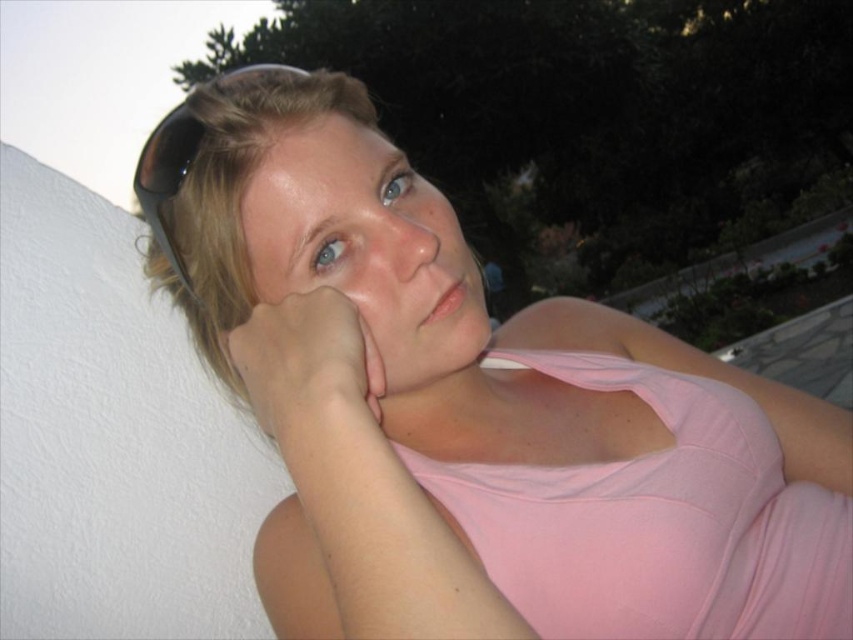
Question: Which of the following is the closest to the observer?

Choices:
 (A) (315, 408)
 (B) (177, 145)

Answer: (A)

Question: Which object appears farthest from the camera in this image?

Choices:
 (A) black rubber goggles at upper left
 (B) pink matte hand at center

Answer: (A)

Question: Is pink matte hand at center smaller than black rubber goggles at upper left?

Choices:
 (A) yes
 (B) no

Answer: (A)

Question: Is pink matte hand at center further to the viewer compared to black rubber goggles at upper left?

Choices:
 (A) no
 (B) yes

Answer: (A)

Question: Is pink matte hand at center above black rubber goggles at upper left?

Choices:
 (A) yes
 (B) no

Answer: (B)